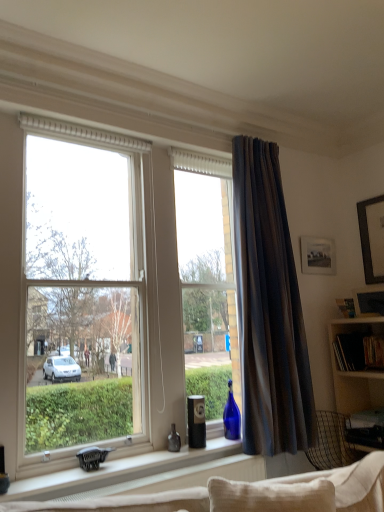
Locate an element on the screen. This screenshot has height=512, width=384. empty space that is ontop of white matte window sill at center (from a real-world perspective) is located at coordinates (121, 462).